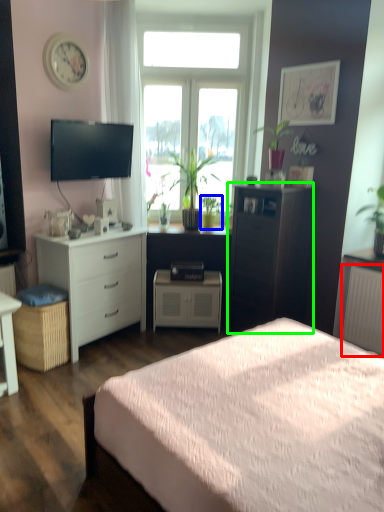
Question: Estimate the real-world distances between objects in this image. Which object is farther from radiator (highlighted by a red box), houseplant (highlighted by a blue box) or chest of drawers (highlighted by a green box)?

Choices:
 (A) houseplant
 (B) chest of drawers

Answer: (A)